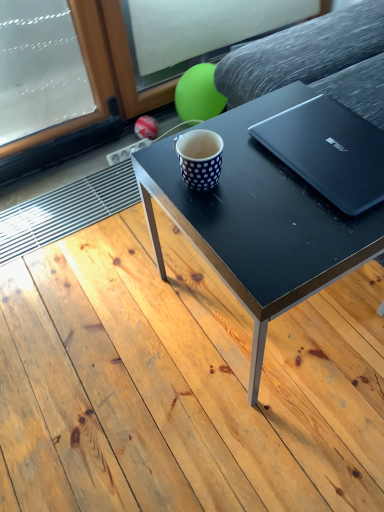
Question: Which is correct: black matte table at center is inside black matte coffee table at center, or outside of it?

Choices:
 (A) inside
 (B) outside

Answer: (B)

Question: In the image, is black matte table at center on the left side or the right side of black matte coffee table at center?

Choices:
 (A) left
 (B) right

Answer: (A)

Question: Based on their relative distances, which object is nearer to the white dotted mug at center?

Choices:
 (A) black matte coffee table at center
 (B) black matte table at center
 (C) black matte laptop at upper right

Answer: (A)

Question: Which of these objects is positioned farthest from the white dotted mug at center?

Choices:
 (A) black matte laptop at upper right
 (B) black matte coffee table at center
 (C) black matte table at center

Answer: (C)